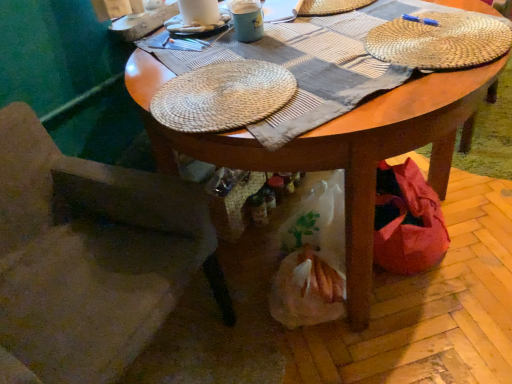
At what (x,y) coordinates should I click in order to perform the action: click on free area in between woven straw placemat at center, which is the first hat in bottom-to-top order, and woven straw placemat at upper right, which appears as the 2th hat when ordered from the bottom. Please return your answer as a coordinate pair (x, y). Looking at the image, I should click on pos(337,73).